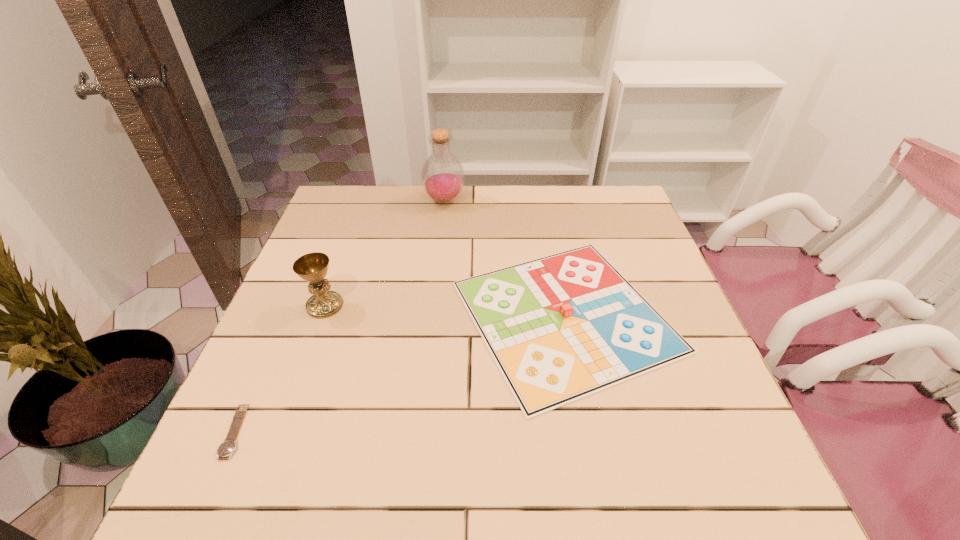
Locate an element on the screen. vacant space positioned on the back of the leftmost object is located at coordinates (268, 359).

This screenshot has width=960, height=540. Identify the location of object that is at the far edge. (442, 175).

Find the location of a particular element. object located at the near edge is located at coordinates (229, 445).

Where is `chalice located in the left edge section of the desktop`? The height and width of the screenshot is (540, 960). chalice located in the left edge section of the desktop is located at coordinates (312, 267).

At what (x,y) coordinates should I click in order to perform the action: click on watch situated at the left edge. Please return your answer as a coordinate pair (x, y). Looking at the image, I should click on (229, 445).

Find the location of a particular element. object at the right edge is located at coordinates (562, 327).

Locate an element on the screen. This screenshot has width=960, height=540. object present at the near left corner is located at coordinates (229, 445).

The height and width of the screenshot is (540, 960). In the image, there is a desktop. In order to click on vacant space at the near edge in this screenshot , I will do `click(591, 484)`.

In order to click on vacant space at the left edge in this screenshot , I will do `click(271, 320)`.

Where is `vacant space at the right edge of the desktop`? vacant space at the right edge of the desktop is located at coordinates (685, 418).